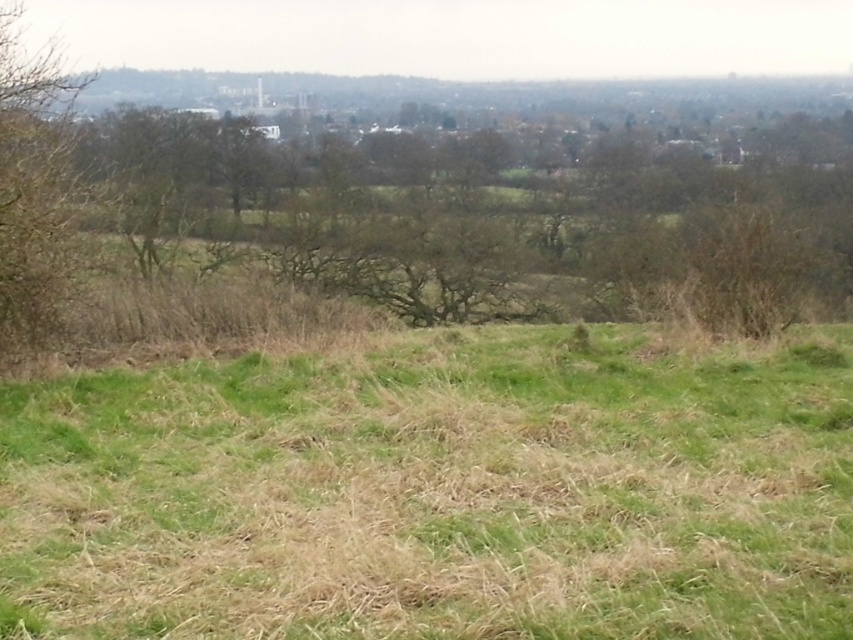
Question: Considering the real-world distances, which object is closest to the brown leafy tree at left?

Choices:
 (A) brown leafless tree at center
 (B) green grass at center

Answer: (B)

Question: Is brown leafless tree at center wider than brown leafy tree at left?

Choices:
 (A) yes
 (B) no

Answer: (A)

Question: Estimate the real-world distances between objects in this image. Which object is closer to the brown leafy tree at left?

Choices:
 (A) green grass at center
 (B) brown leafless tree at center

Answer: (A)

Question: Which of the following is the farthest from the observer?

Choices:
 (A) brown leafless tree at center
 (B) green grass at center
 (C) brown leafy tree at left

Answer: (A)

Question: Where is green grass at center located in relation to brown leafy tree at left in the image?

Choices:
 (A) below
 (B) above

Answer: (A)

Question: Can you confirm if green grass at center is wider than brown leafy tree at left?

Choices:
 (A) no
 (B) yes

Answer: (A)